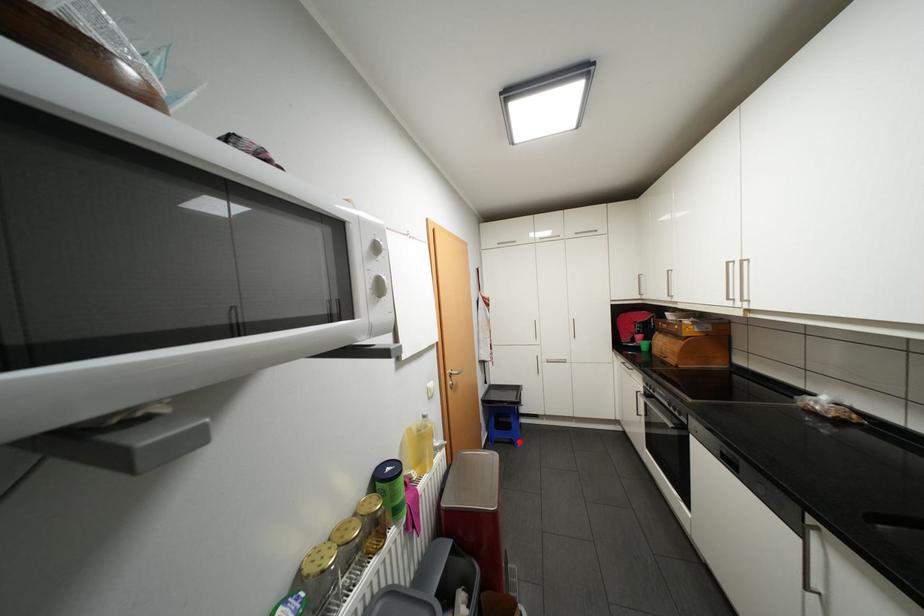
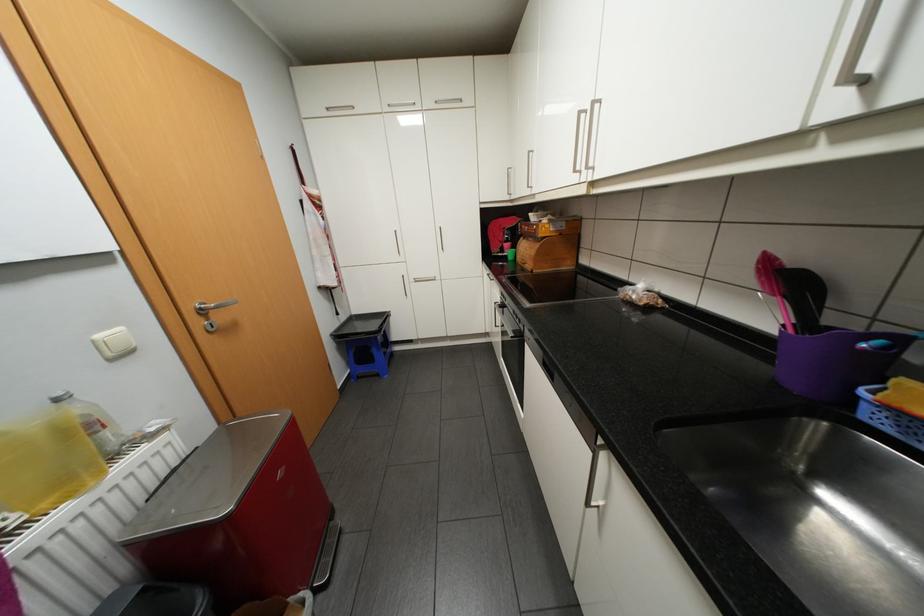
Question: I am providing you with two images of the same scene from different viewpoints. Given a red point in image1, look at the same physical point in image2. Is it:

Choices:
 (A) Closer to the viewpoint
 (B) Farther from the viewpoint

Answer: (A)